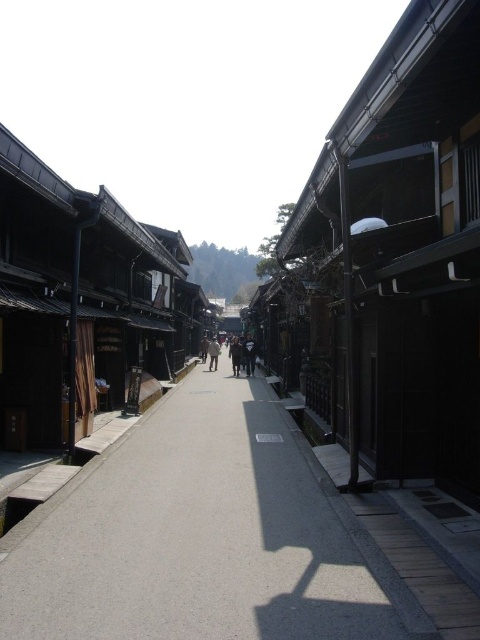
Question: Does dark gray fabric coat at center have a larger size compared to dark blue jeans at center?

Choices:
 (A) no
 (B) yes

Answer: (B)

Question: Considering the relative positions of dark gray fabric coat at center and light brown wooden person at center in the image provided, where is dark gray fabric coat at center located with respect to light brown wooden person at center?

Choices:
 (A) below
 (B) above

Answer: (B)

Question: Which object is closer to the camera taking this photo?

Choices:
 (A) dark gray fabric coat at center
 (B) light brown wooden person at center
 (C) gray concrete pavement at center
 (D) dark blue jeans at center

Answer: (C)

Question: In this image, where is dark gray fabric coat at center located relative to dark blue jeans at center?

Choices:
 (A) left
 (B) right

Answer: (B)

Question: Which object is the closest to the light brown wooden person at center?

Choices:
 (A) dark blue jeans at center
 (B) dark gray fabric coat at center
 (C) gray concrete pavement at center

Answer: (B)

Question: Which object is positioned farthest from the light brown wooden person at center?

Choices:
 (A) dark blue jeans at center
 (B) dark gray fabric coat at center
 (C) gray concrete pavement at center

Answer: (C)